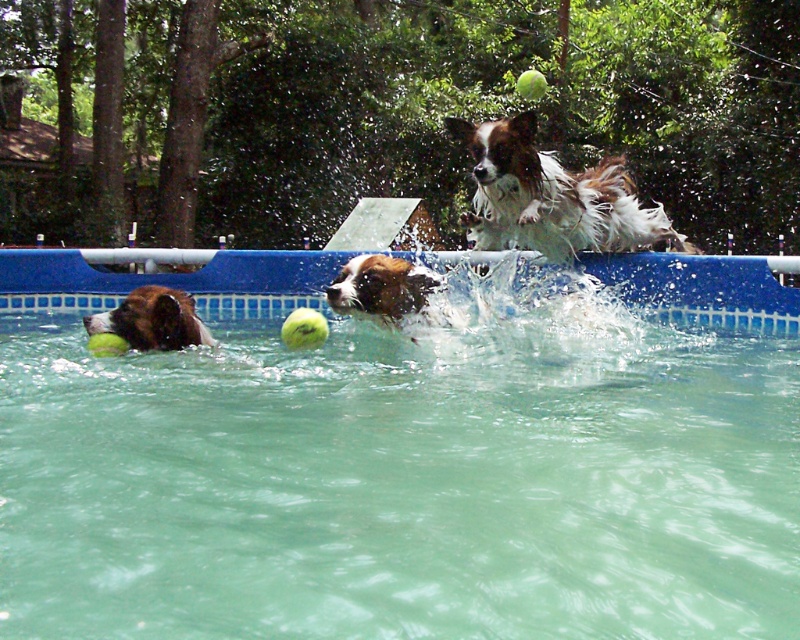
Can you confirm if white and brown fur dog at upper center is shorter than brown and white fur dog at left?

No.

Which of these two, white and brown fur dog at upper center or brown and white fur dog at left, stands taller?

With more height is white and brown fur dog at upper center.

Locate an element on the screen. The height and width of the screenshot is (640, 800). white and brown fur dog at upper center is located at coordinates (552, 196).

Who is taller, white and brown fur dog at upper center or white and brown fur dog at center?

white and brown fur dog at upper center is taller.

Does point (564, 204) come in front of point (416, 291)?

No.

Is point (568, 182) closer to camera compared to point (377, 268)?

No, it is behind (377, 268).

The width and height of the screenshot is (800, 640). I want to click on white and brown fur dog at upper center, so click(552, 196).

Between blue plastic swimming pool at center and white and brown fur dog at center, which one appears on the right side from the viewer's perspective?

From the viewer's perspective, white and brown fur dog at center appears more on the right side.

Between blue plastic swimming pool at center and white and brown fur dog at center, which one is positioned lower?

blue plastic swimming pool at center is below.

Which is in front, point (244, 557) or point (416, 292)?

Positioned in front is point (244, 557).

The height and width of the screenshot is (640, 800). Identify the location of blue plastic swimming pool at center. (404, 456).